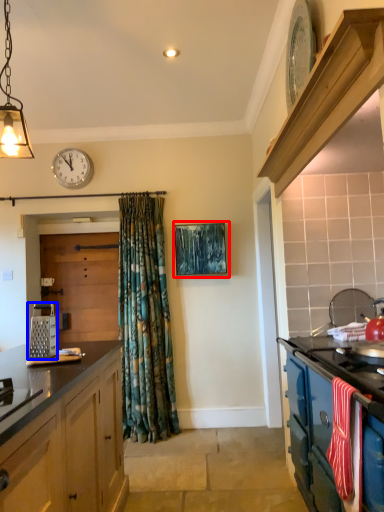
Question: Which object is closer to the camera taking this photo, picture frame (highlighted by a red box) or appliance (highlighted by a blue box)?

Choices:
 (A) picture frame
 (B) appliance

Answer: (B)